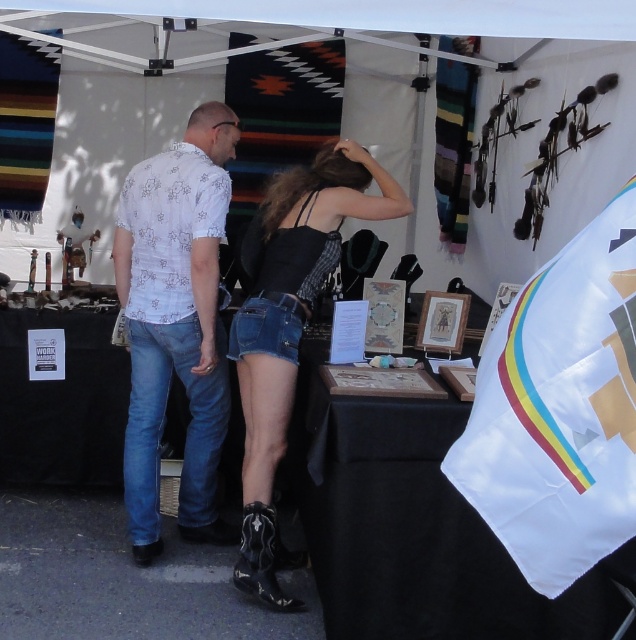
Question: Which object appears farthest from the camera in this image?

Choices:
 (A) denim shorts at center
 (B) white floral shirt at center

Answer: (B)

Question: Which is farther from the black fabric table at center?

Choices:
 (A) denim shorts at center
 (B) white floral shirt at center

Answer: (B)

Question: Does black fabric table at center appear over white floral shirt at center?

Choices:
 (A) no
 (B) yes

Answer: (A)

Question: Is white floral shirt at center wider than denim shorts at center?

Choices:
 (A) yes
 (B) no

Answer: (B)

Question: Is black fabric table at center smaller than denim shorts at center?

Choices:
 (A) no
 (B) yes

Answer: (A)

Question: Which is farther from the black fabric table at center?

Choices:
 (A) denim shorts at center
 (B) white floral shirt at center

Answer: (B)